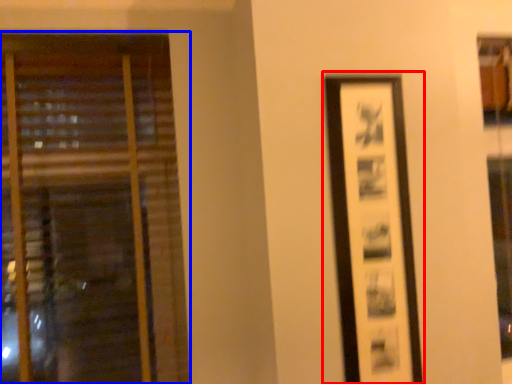
Question: Which of the following is the farthest to the observer, picture frame (highlighted by a red box) or window (highlighted by a blue box)?

Choices:
 (A) picture frame
 (B) window

Answer: (B)